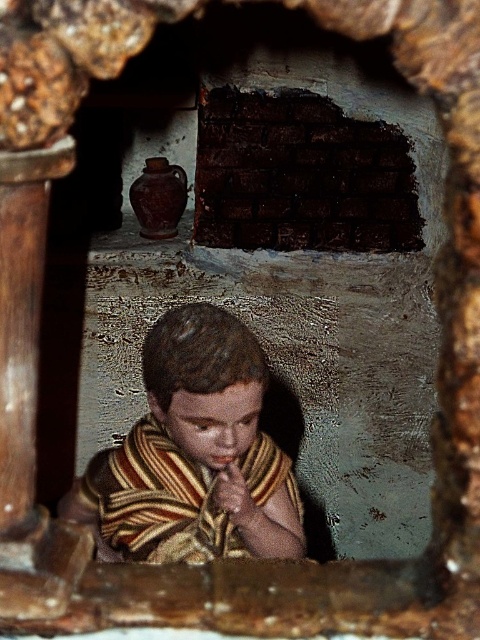
Based on the scene described, can the striped fabric child at center reach the top of the dark brick wall at center if they stand on their tiptoes?

The striped fabric child at center is taller than the dark brick wall at center, so they can easily reach the top without needing to stand on tiptoes.

You are an interior designer assessing the space through the arched opening. The striped fabric child at center and dark brick wall at center are visible. Which object occupies more horizontal space in the scene?

The dark brick wall at center occupies more horizontal space than the striped fabric child at center because the striped fabric child at center has a lesser width compared to the dark brick wall at center.